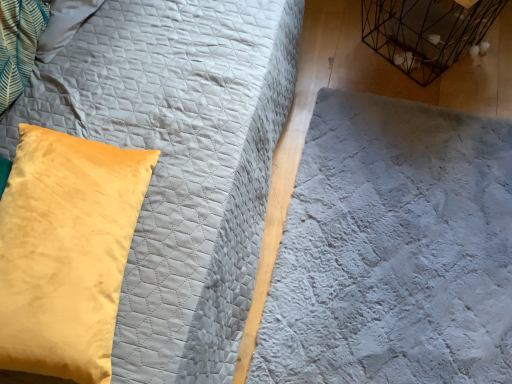
The height and width of the screenshot is (384, 512). I want to click on vacant space situated above white quilted fabric at center (from a real-world perspective), so click(x=385, y=182).